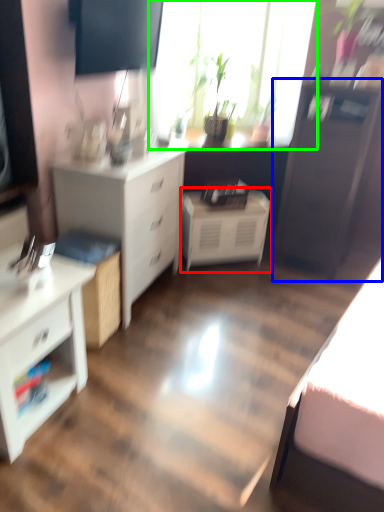
Question: Which is nearer to the nightstand (highlighted by a red box)? file cabinet (highlighted by a blue box) or window (highlighted by a green box).

Choices:
 (A) file cabinet
 (B) window

Answer: (A)